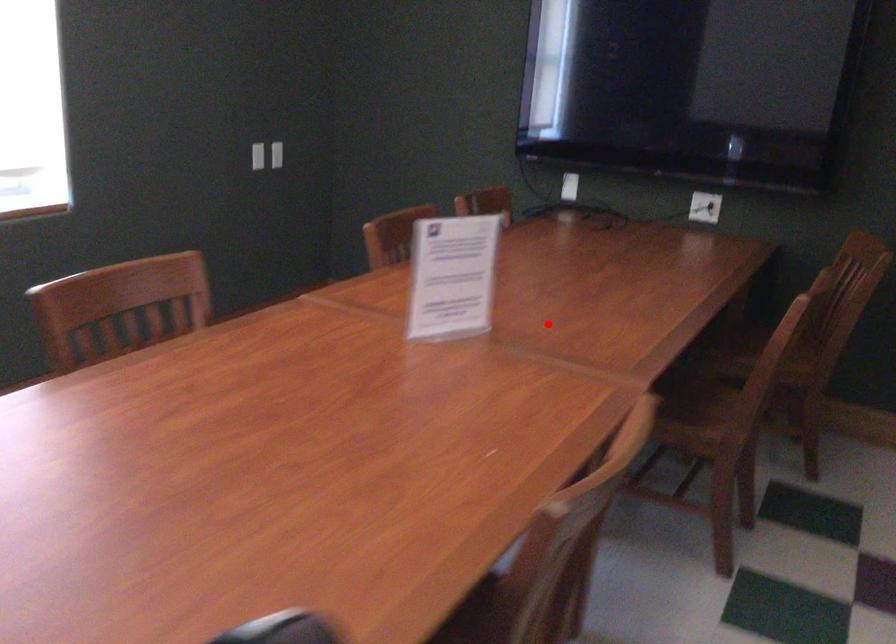
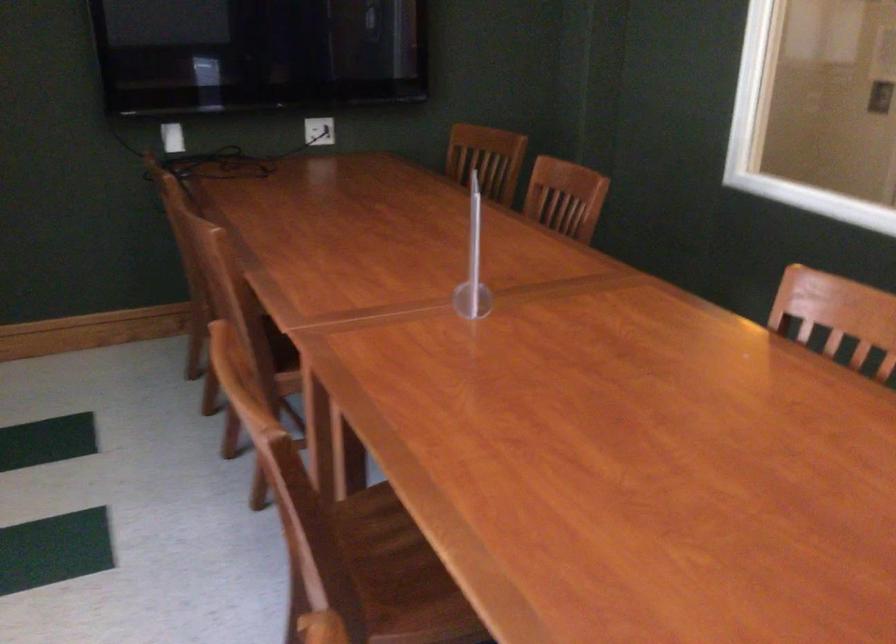
Find the pixel in the second image that matches the highlighted location in the first image.

(472, 263)